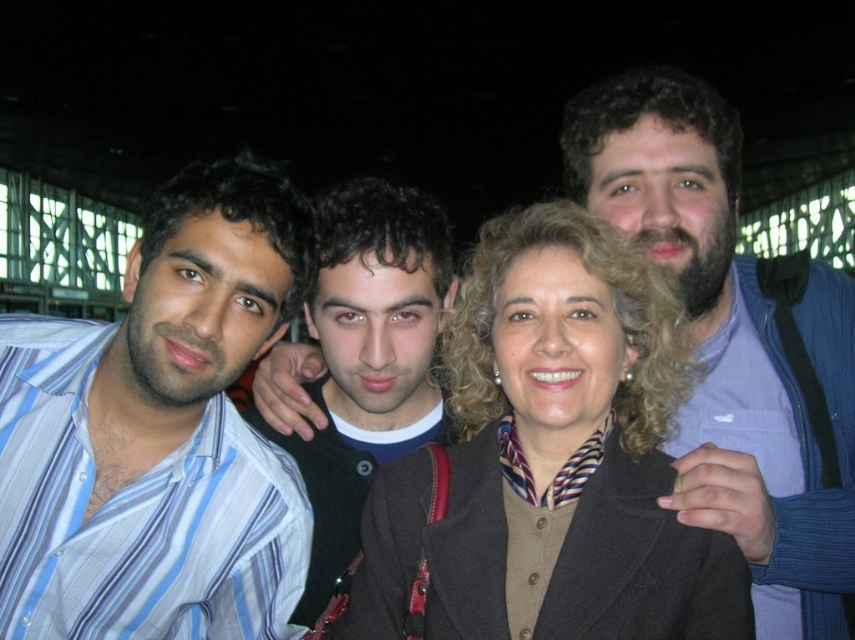
Question: Does dark brown woolen coat at center have a smaller size compared to dark brown hair at center?

Choices:
 (A) yes
 (B) no

Answer: (B)

Question: Which object is farther from the camera taking this photo?

Choices:
 (A) bearded man at right
 (B) dark brown woolen coat at center

Answer: (A)

Question: Considering the real-world distances, which object is farthest from the striped cotton shirt at left?

Choices:
 (A) dark brown woolen coat at center
 (B) dark brown hair at center
 (C) bearded man at right

Answer: (C)

Question: Is dark brown woolen coat at center smaller than striped cotton shirt at left?

Choices:
 (A) yes
 (B) no

Answer: (B)

Question: Is striped cotton shirt at left wider than dark brown hair at center?

Choices:
 (A) yes
 (B) no

Answer: (A)

Question: Which of the following is the farthest from the observer?

Choices:
 (A) (700, 451)
 (B) (3, 554)
 (C) (380, 344)

Answer: (C)